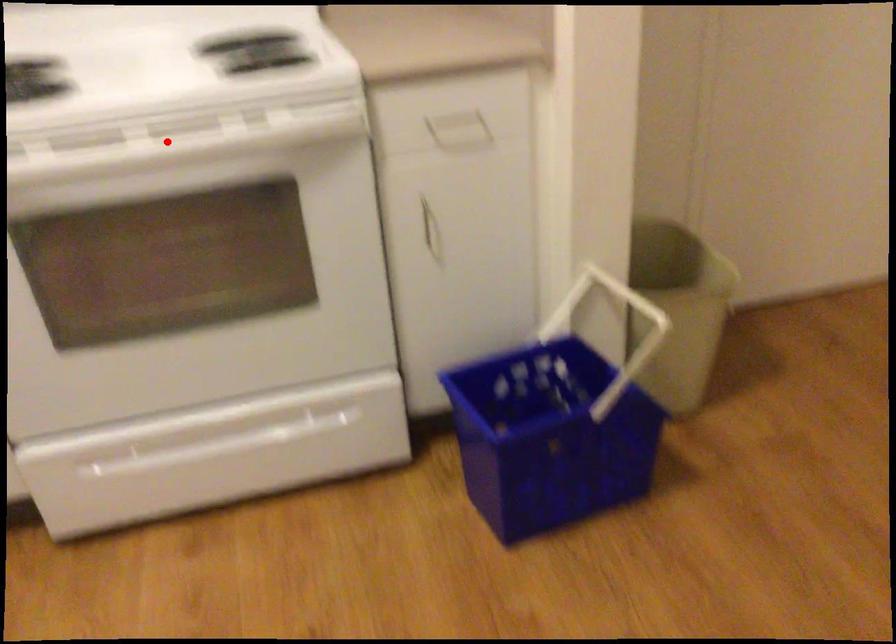
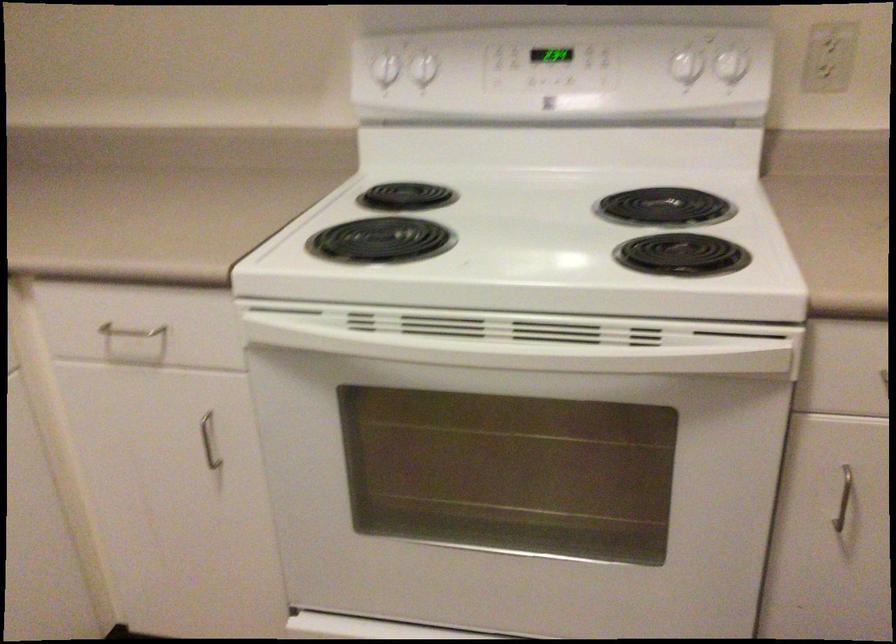
Where in the second image is the point corresponding to the highlighted location from the first image?

(526, 339)